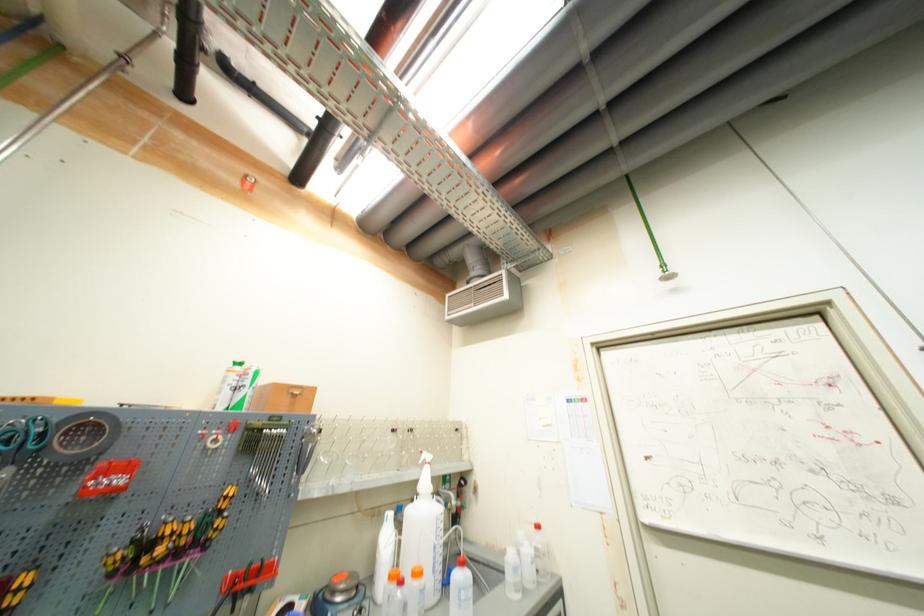
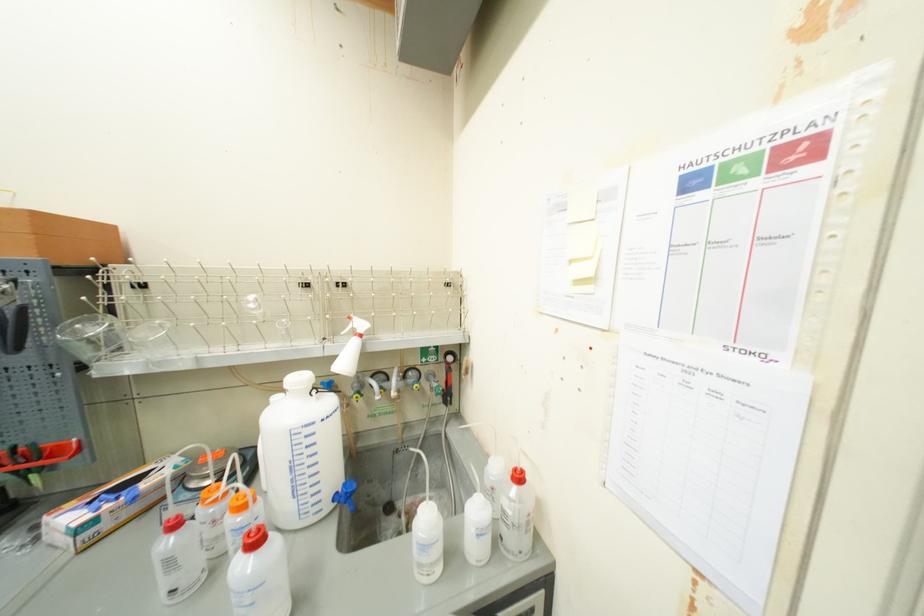
In the second image, find the point that corresponds to (x=439, y=500) in the first image.

(317, 398)